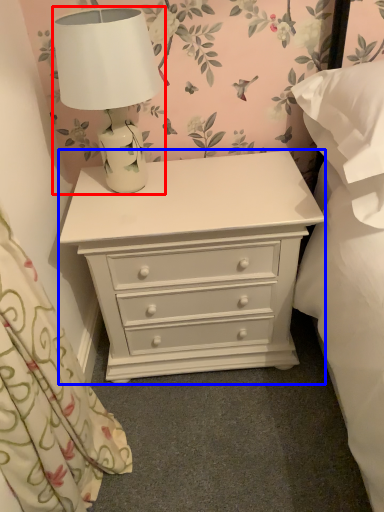
Question: Which point is closer to the camera, lamp (highlighted by a red box) or chest of drawers (highlighted by a blue box)?

Choices:
 (A) lamp
 (B) chest of drawers

Answer: (A)